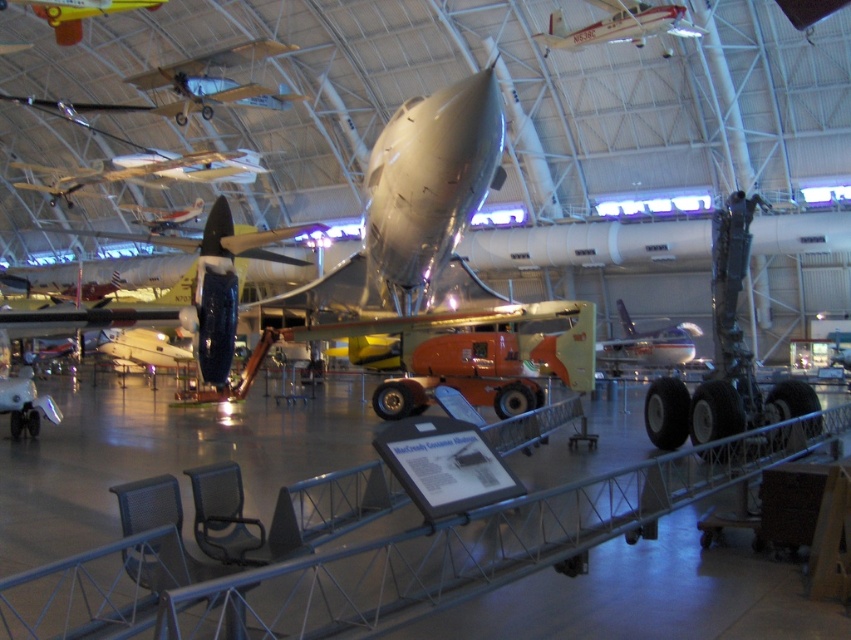
You are a visitor at the aviation museum and want to take a photo of both the shiny silver airplane at upper center and the matte orange airplane at center. Which airplane should you stand closer to in order to capture both in a single frame without zooming?

You should stand closer to the matte orange airplane at center because the shiny silver airplane at upper center is much taller, so by positioning yourself nearer to the shorter one, both can fit within the camera frame.

You are standing at the entrance of the aviation museum and see the silver metallic airplane at upper center and the vintage orange and yellow airplane in the foreground. Which airplane is farther from you?

The silver metallic airplane at upper center is farther from you than the vintage orange and yellow airplane in the foreground because they are 36.07 feet apart.